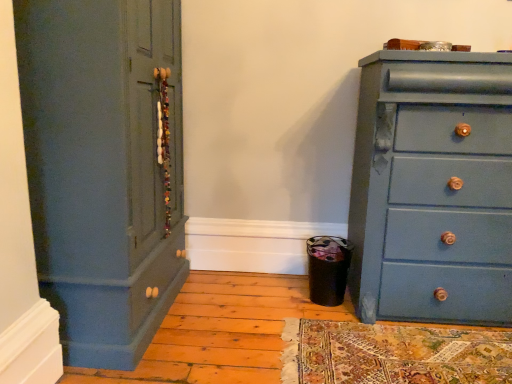
Question: Does matte blue dresser at right have a smaller size compared to matte blue cupboard at left?

Choices:
 (A) yes
 (B) no

Answer: (A)

Question: Can you confirm if matte blue dresser at right is bigger than matte blue cupboard at left?

Choices:
 (A) no
 (B) yes

Answer: (A)

Question: Is matte blue dresser at right thinner than matte blue cupboard at left?

Choices:
 (A) no
 (B) yes

Answer: (B)

Question: Are matte blue dresser at right and matte blue cupboard at left making contact?

Choices:
 (A) no
 (B) yes

Answer: (A)

Question: Considering the relative sizes of matte blue dresser at right and matte blue cupboard at left in the image provided, is matte blue dresser at right taller than matte blue cupboard at left?

Choices:
 (A) no
 (B) yes

Answer: (A)

Question: Is matte blue dresser at right completely or partially outside of matte blue cupboard at left?

Choices:
 (A) yes
 (B) no

Answer: (A)

Question: Is matte blue cupboard at left oriented towards matte blue dresser at right?

Choices:
 (A) no
 (B) yes

Answer: (B)

Question: Would you say matte blue cupboard at left contains matte blue dresser at right?

Choices:
 (A) no
 (B) yes

Answer: (A)

Question: Can you confirm if matte blue cupboard at left is taller than matte blue dresser at right?

Choices:
 (A) yes
 (B) no

Answer: (A)

Question: Does matte blue cupboard at left have a larger size compared to matte blue dresser at right?

Choices:
 (A) yes
 (B) no

Answer: (A)

Question: Are matte blue cupboard at left and matte blue dresser at right far apart?

Choices:
 (A) no
 (B) yes

Answer: (B)

Question: Is matte blue cupboard at left at the right side of matte blue dresser at right?

Choices:
 (A) yes
 (B) no

Answer: (B)

Question: From the image's perspective, is matte blue cupboard at left above or below matte blue dresser at right?

Choices:
 (A) above
 (B) below

Answer: (A)